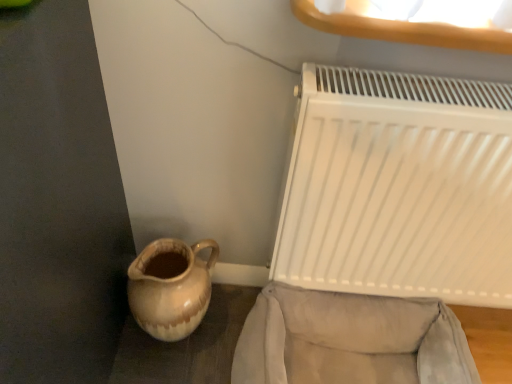
In order to click on vacant space underneath brown glazed jug at lower left (from a real-world perspective) in this screenshot , I will do `click(188, 336)`.